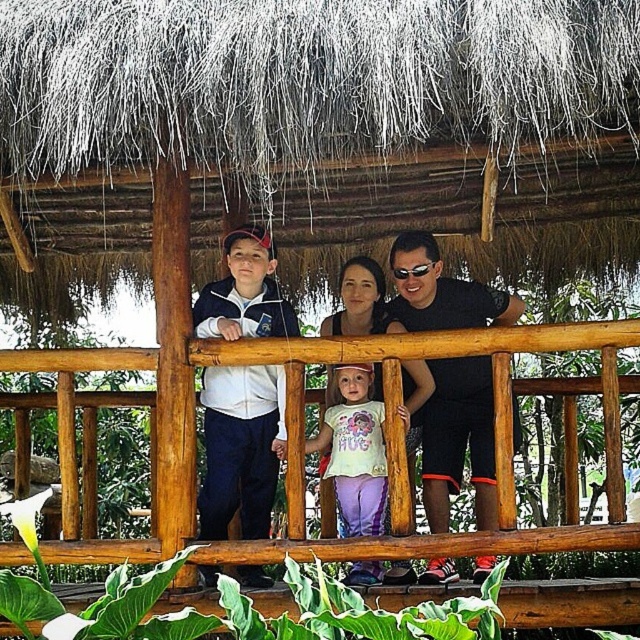
Measure the distance between wooden at center and black matte shirt at center.

A distance of 1.14 meters exists between wooden at center and black matte shirt at center.

Does wooden at center appear over black matte shirt at center?

No, wooden at center is not above black matte shirt at center.

Between point (236, 547) and point (440, 420), which one is positioned in front?

Point (236, 547) is more forward.

This screenshot has width=640, height=640. What are the coordinates of `wooden at center` in the screenshot? It's located at (304, 438).

Locate an element on the screen. The height and width of the screenshot is (640, 640). matte white jacket at center is located at coordinates (241, 448).

How much distance is there between matte white jacket at center and matte white hoodie at center?

A distance of 37.47 inches exists between matte white jacket at center and matte white hoodie at center.

Locate an element on the screen. matte white jacket at center is located at coordinates (241, 448).

Locate an element on the screen. This screenshot has width=640, height=640. matte white jacket at center is located at coordinates (241, 448).

Between point (429, 282) and point (481, 298), which one is positioned in front?

Positioned in front is point (429, 282).

Is black matte shirt at center to the right of matte white hoodie at center from the viewer's perspective?

Yes, black matte shirt at center is to the right of matte white hoodie at center.

You are a GUI agent. You are given a task and a screenshot of the screen. Output one action in this format:
    pyautogui.click(x=<x>, y=<y>)
    Task: Click on the black matte shirt at center
    The image size is (640, 640).
    Given the screenshot: What is the action you would take?
    pyautogui.click(x=458, y=440)

Image resolution: width=640 pixels, height=640 pixels. I want to click on black matte shirt at center, so coord(458,440).